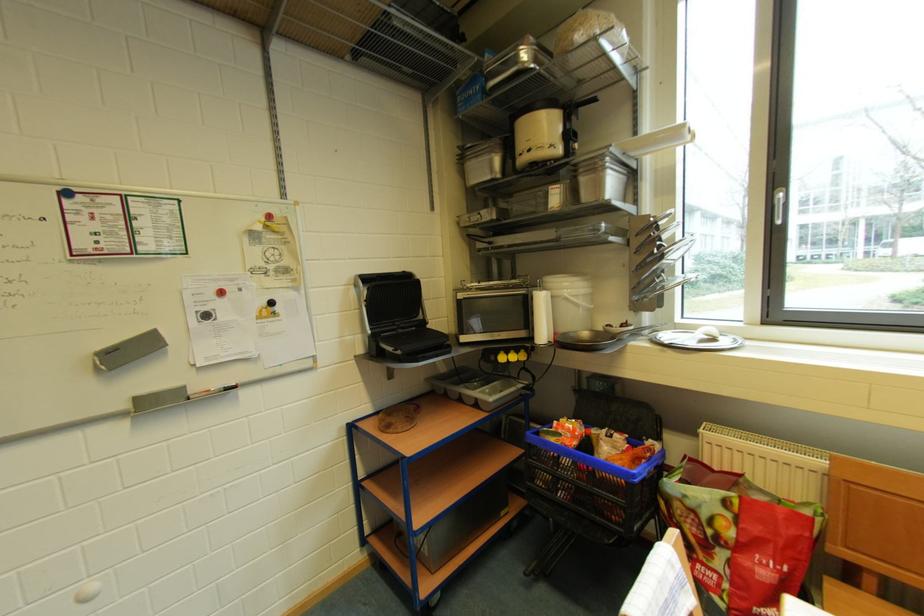
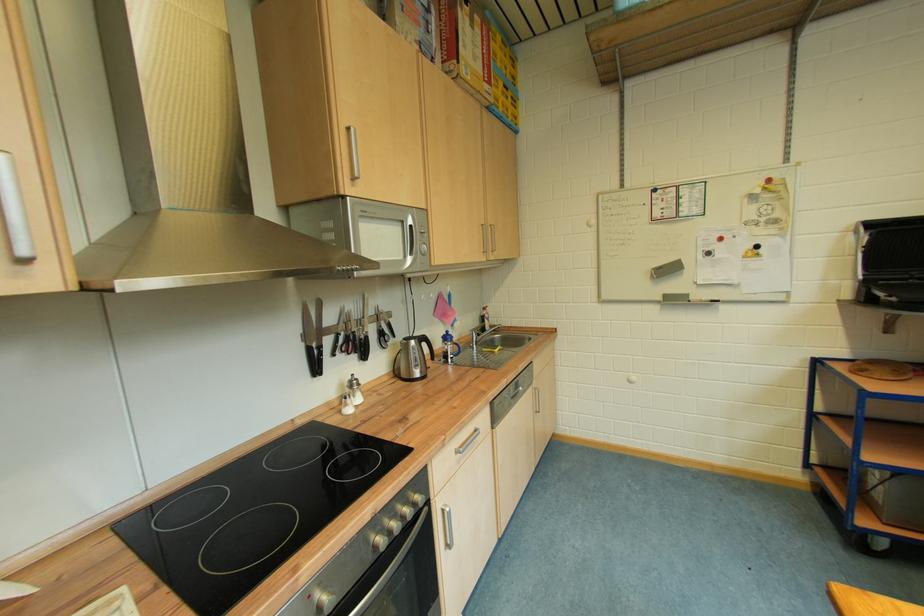
Where in the second image is the point corresponding to point (395, 432) from the first image?

(868, 377)